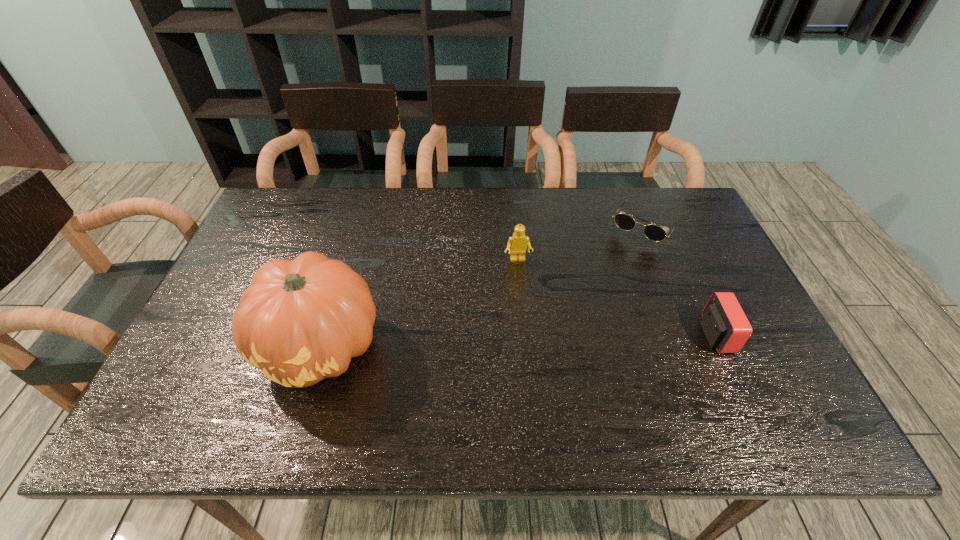
Find the location of a particular element. The width and height of the screenshot is (960, 540). vacant space at the left edge is located at coordinates (264, 250).

This screenshot has height=540, width=960. In order to click on blank space at the right edge of the desktop in this screenshot , I will do 673,257.

Identify the location of free location at the far left corner. (261, 213).

The height and width of the screenshot is (540, 960). I want to click on blank area at the near left corner, so click(x=212, y=381).

At what (x,y) coordinates should I click in order to perform the action: click on free space at the far right corner of the desktop. Please return your answer as a coordinate pair (x, y). This screenshot has width=960, height=540. Looking at the image, I should click on (684, 213).

Locate an element on the screen. The height and width of the screenshot is (540, 960). empty space that is in between the sunglasses and the alarm clock is located at coordinates (680, 281).

Where is `blank region between the third object from right to left and the alarm clock`? This screenshot has height=540, width=960. blank region between the third object from right to left and the alarm clock is located at coordinates (616, 298).

Where is `free space between the leftmost object and the alarm clock`? free space between the leftmost object and the alarm clock is located at coordinates click(518, 341).

At what (x,y) coordinates should I click in order to perform the action: click on free point between the third nearest object and the alarm clock. Please return your answer as a coordinate pair (x, y). The height and width of the screenshot is (540, 960). Looking at the image, I should click on (616, 298).

This screenshot has height=540, width=960. Identify the location of vacant area that lies between the second tallest object and the tallest object. (420, 303).